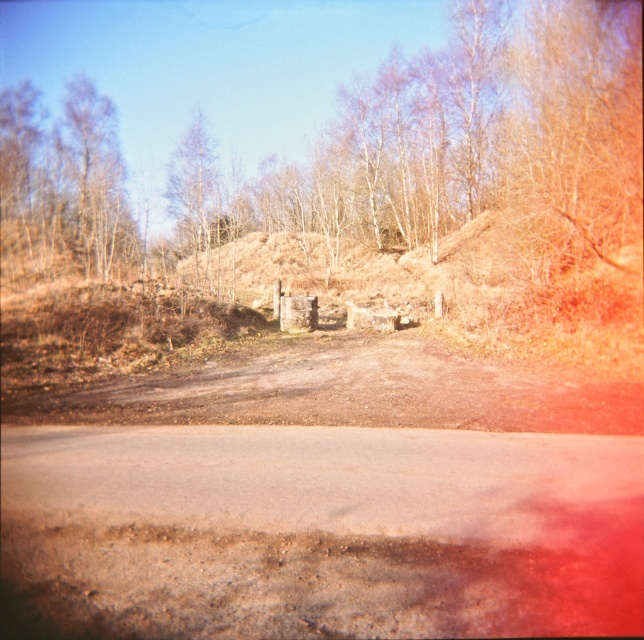
You are a hiker standing on the dull gray asphalt at center and looking towards the brown textured tree at upper center. Can you see the tree clearly from your current position?

Yes, the dull gray asphalt at center is in front of the brown textured tree at upper center, so the tree is visible from that position.

You are standing at the point marked by coordinates point (328,529) in the image. What material are you standing on?

The point (328,529) marks dull gray asphalt at center, so you are standing on dull gray asphalt.

You are a delivery driver who needs to drive a truck with a width of 2 meters. You are currently on the dull gray asphalt at center and want to pass through the brown textured tree at upper center. Can your truck fit through the space between them?

The dull gray asphalt at center is thinner than the brown textured tree at upper center. Since the asphalt is thinner, it means the space between them is narrower than the tree. However, without exact measurements, it is uncertain if the 2 meter wide truck can pass. The driver should proceed with caution or choose an alternative route if available.